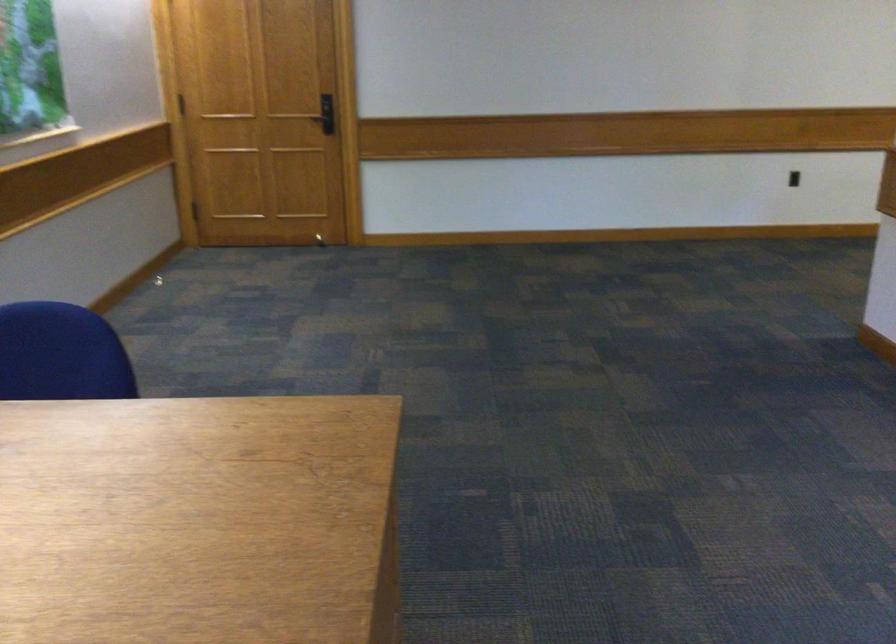
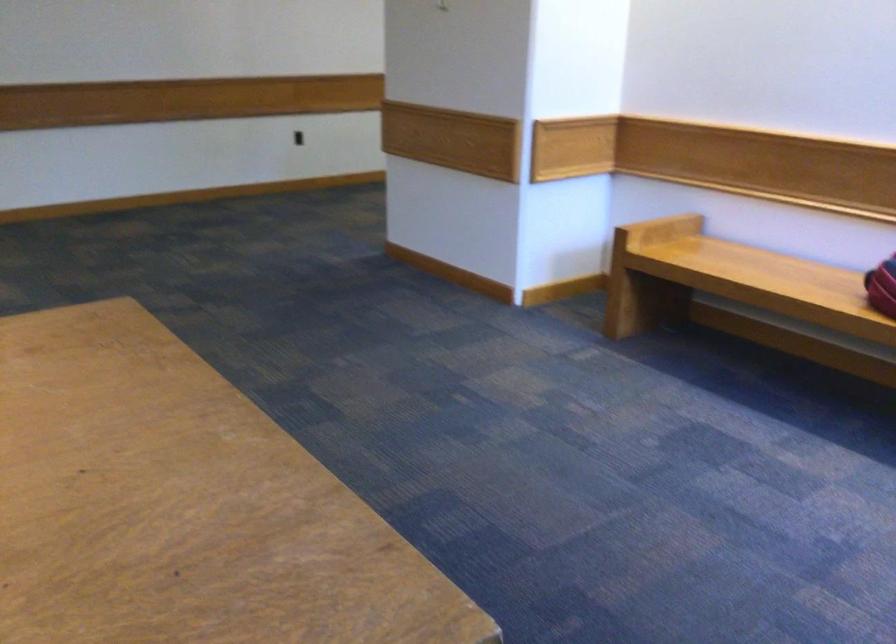
Question: The images are taken continuously from a first-person perspective. In which direction is your viewpoint rotating?

Choices:
 (A) Left
 (B) Right
 (C) Up
 (D) Down

Answer: (B)